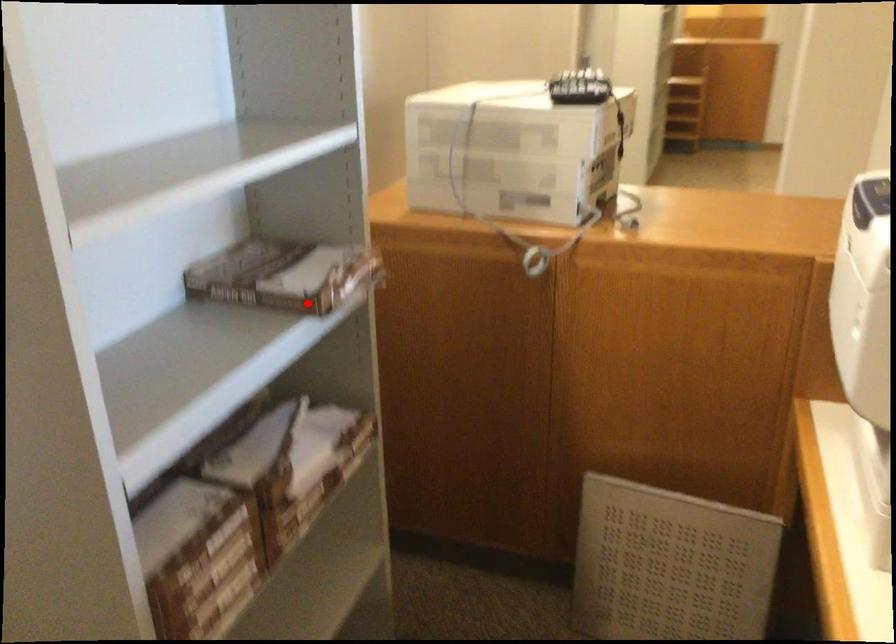
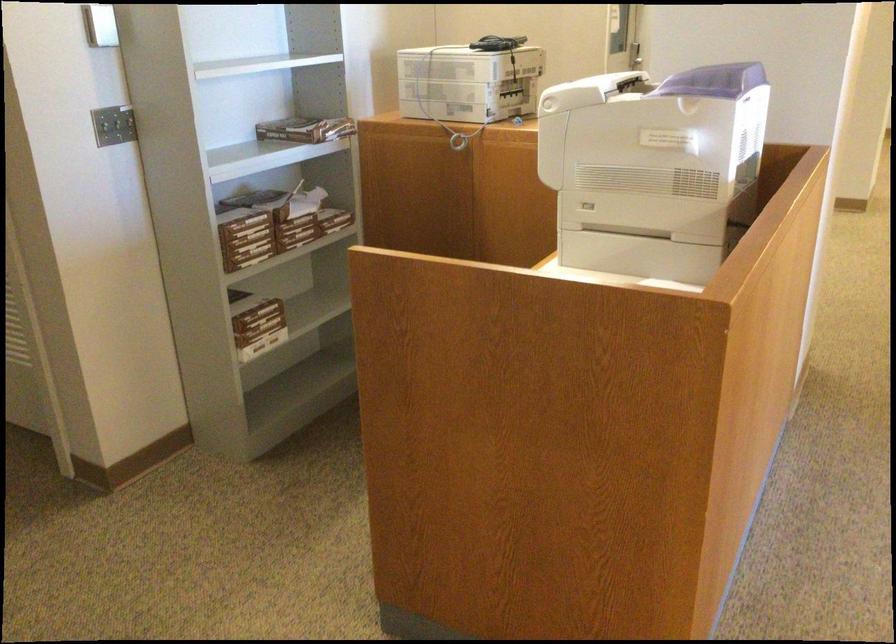
Find the pixel in the second image that matches the highlighted location in the first image.

(306, 129)